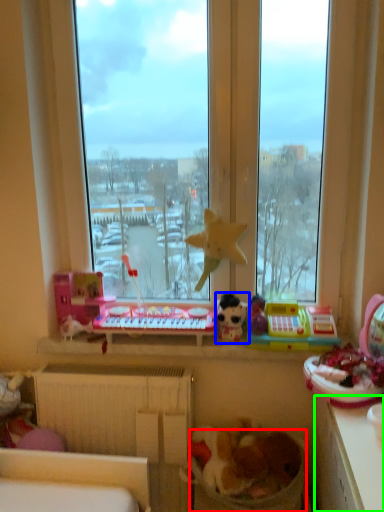
Question: Which object is positioned farthest from laundry basket (highlighted by a red box)? Select from toy (highlighted by a blue box) and counter top (highlighted by a green box).

Choices:
 (A) toy
 (B) counter top

Answer: (A)